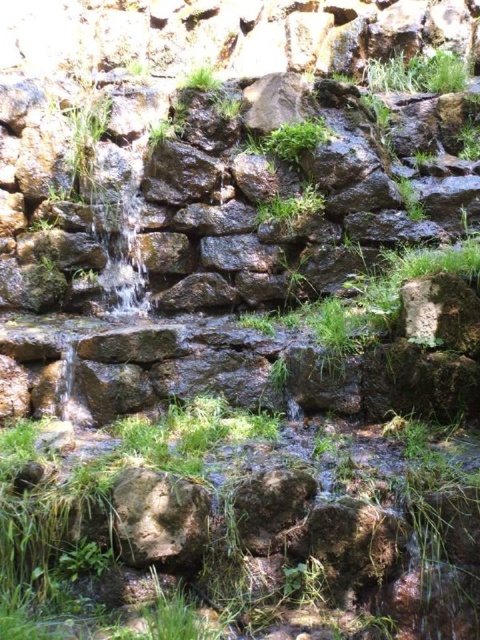
You are standing at the edge of the waterfall and want to step onto the green grassy area at lower center. Is the rough textured rock at center between you and the green grassy at lower center?

The green grassy at lower center is closer to the viewer than the rough textured rock at center, so the rough textured rock at center is behind the green grassy at lower center. Therefore, the rough textured rock at center is not between you and the green grassy at lower center.